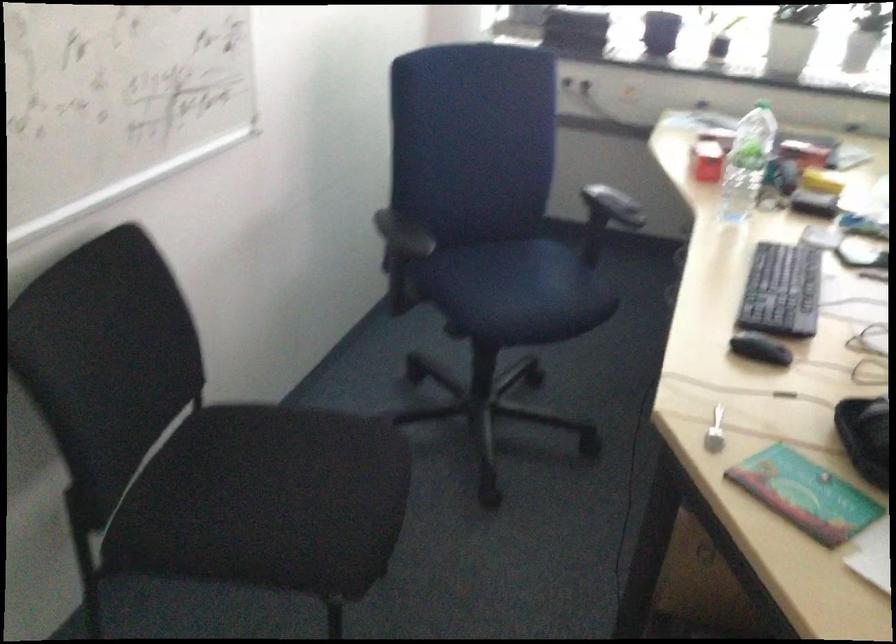
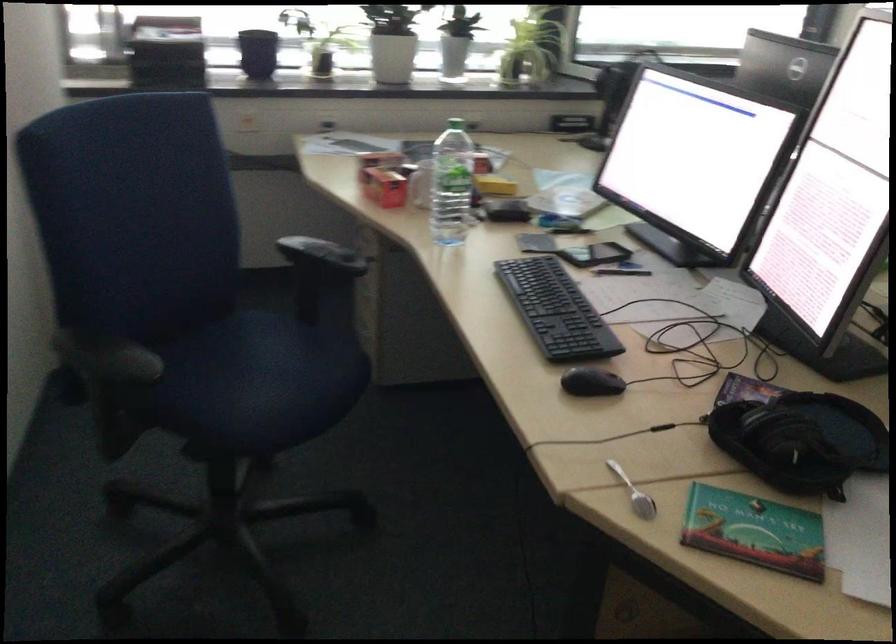
The point at (719,436) is marked in the first image. Where is the corresponding point in the second image?

(633, 494)